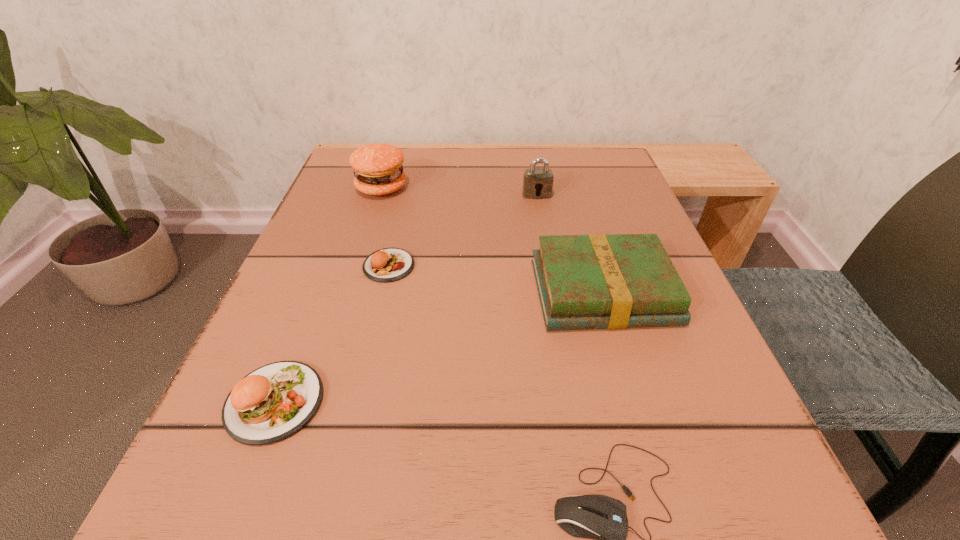
The width and height of the screenshot is (960, 540). What are the coordinates of `vacant space located 0.270m on the back of the second nearest patty (food)` in the screenshot? It's located at (411, 173).

Find the location of a particular element. The width and height of the screenshot is (960, 540). patty located in the far edge section of the desktop is located at coordinates (378, 170).

Identify the location of padlock at the far edge. (536, 181).

Where is `object located at the right edge`? The image size is (960, 540). object located at the right edge is located at coordinates (596, 281).

The width and height of the screenshot is (960, 540). I want to click on object that is at the far left corner, so click(x=378, y=170).

Find the location of a particular element. The height and width of the screenshot is (540, 960). vacant area at the far edge is located at coordinates (421, 165).

Identify the location of free region at the left edge of the desktop. The image size is (960, 540). 306,241.

At what (x,y) coordinates should I click in order to perform the action: click on vacant point at the right edge. Please return your answer as a coordinate pair (x, y). The width and height of the screenshot is (960, 540). Looking at the image, I should click on (624, 330).

In the image, there is a desktop. Where is `vacant space at the near left corner`? The width and height of the screenshot is (960, 540). vacant space at the near left corner is located at coordinates (313, 497).

I want to click on free space at the far right corner of the desktop, so click(x=600, y=188).